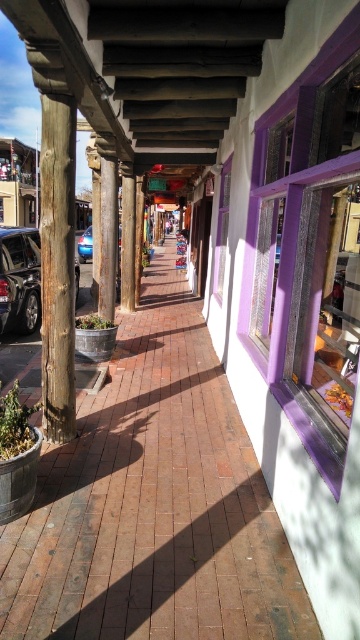
You are standing at the point marked as point (231,492) in the pedestrian walkway. If you want to take a photo of the building with white walls and purple window frames on the right side, will you be able to capture it fully in your camera frame without moving from your current position?

The point (231,492) is 11.71 feet away from the viewer. Since the building with white walls and purple window frames is on the right side of the walkway, and assuming the camera has a standard field of view, you should be able to capture the building fully without moving.

You are a delivery person with a cart that is 2 meters wide. You need to navigate through the pedestrian walkway under the covered arcade. The walkway is narrow, and you must pass between the weathered wood post at left and the shiny blue sedan at center. Can your cart fit through the space between them?

The distance between the weathered wood post at left and the shiny blue sedan at center is 11.28 meters. Since your cart is only 2 meters wide, there is more than enough space for it to pass through the gap between them.